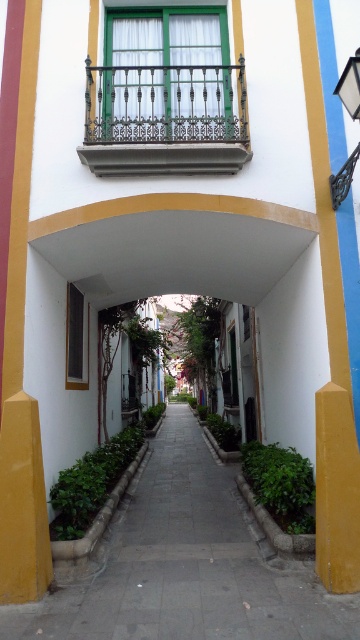
Question: Does paved stone walkway at center have a larger size compared to wrought iron balcony at upper center?

Choices:
 (A) no
 (B) yes

Answer: (B)

Question: Is paved stone walkway at center bigger than wrought iron balcony at upper center?

Choices:
 (A) no
 (B) yes

Answer: (B)

Question: Among these objects, which one is nearest to the camera?

Choices:
 (A) wrought iron balcony at upper center
 (B) paved stone walkway at center

Answer: (B)

Question: Where is paved stone walkway at center located in relation to wrought iron balcony at upper center in the image?

Choices:
 (A) below
 (B) above

Answer: (A)

Question: Among these points, which one is farthest from the camera?

Choices:
 (A) (182, 531)
 (B) (99, 152)

Answer: (A)